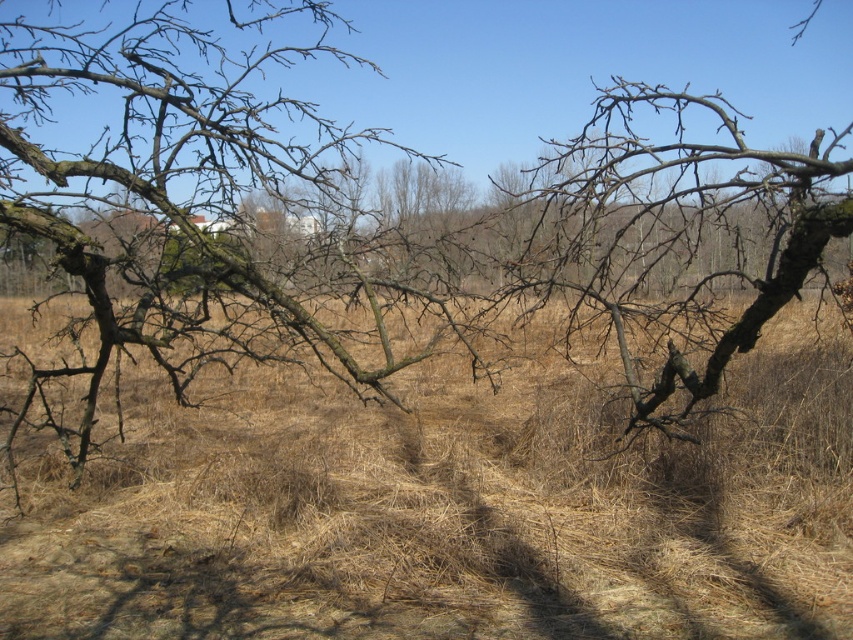
Question: Where is brown dry grass at center located in relation to brown rough bark tree at center in the image?

Choices:
 (A) below
 (B) above

Answer: (A)

Question: Which object appears closest to the camera in this image?

Choices:
 (A) brown dry grass at center
 (B) brown rough bark tree at center

Answer: (B)

Question: Which object appears closest to the camera in this image?

Choices:
 (A) brown rough bark tree at center
 (B) brown dry grass at center

Answer: (A)

Question: Can you confirm if brown dry grass at center is positioned above brown rough bark tree at center?

Choices:
 (A) no
 (B) yes

Answer: (A)

Question: Does brown dry grass at center lie behind brown rough bark tree at center?

Choices:
 (A) no
 (B) yes

Answer: (B)